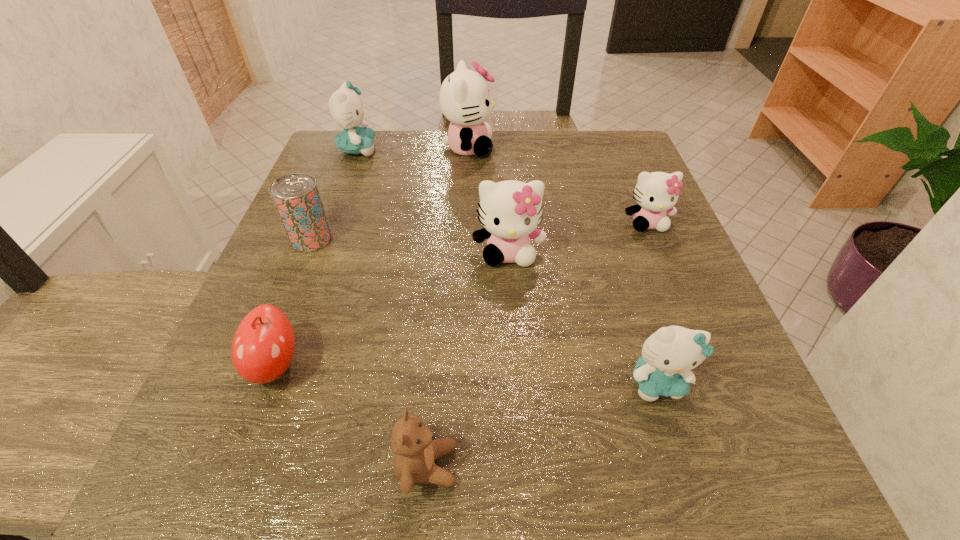
Identify the location of the tallest kitten. This screenshot has height=540, width=960. point(464,95).

In order to click on the biggest white kitten in this screenshot , I will do `click(464, 95)`.

This screenshot has height=540, width=960. Identify the location of the leftmost kitten. (345, 106).

Identify the location of the bigger blue kitten. The width and height of the screenshot is (960, 540). 345,106.

The height and width of the screenshot is (540, 960). In order to click on the second biggest white kitten in this screenshot , I will do `click(510, 211)`.

I want to click on beer can, so click(296, 196).

Where is `the smallest white kitten`? The width and height of the screenshot is (960, 540). the smallest white kitten is located at coordinates (656, 193).

Identify the location of the smaller blue kitten. The width and height of the screenshot is (960, 540). (668, 355).

You are a GUI agent. You are given a task and a screenshot of the screen. Output one action in this format:
    pyautogui.click(x=<x>, y=<y>)
    Task: Click on the nearer blue kitten
    
    Given the screenshot: What is the action you would take?
    tap(668, 355)

Identify the location of apple. [263, 346].